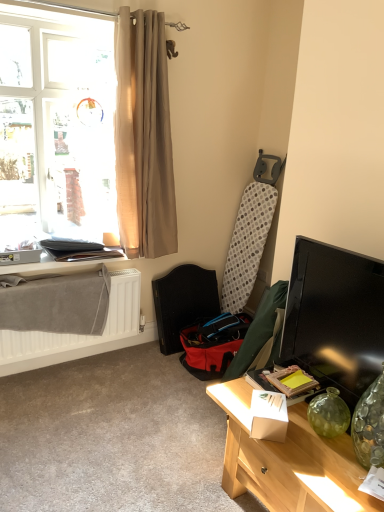
Question: Does matte black table at lower left have a smaller size compared to beige fabric curtain at upper left?

Choices:
 (A) no
 (B) yes

Answer: (B)

Question: Is matte black table at lower left wider than beige fabric curtain at upper left?

Choices:
 (A) yes
 (B) no

Answer: (A)

Question: Can you confirm if matte black table at lower left is shorter than beige fabric curtain at upper left?

Choices:
 (A) yes
 (B) no

Answer: (A)

Question: Is beige fabric curtain at upper left at the back of matte black table at lower left?

Choices:
 (A) no
 (B) yes

Answer: (A)

Question: Can you confirm if matte black table at lower left is bigger than beige fabric curtain at upper left?

Choices:
 (A) yes
 (B) no

Answer: (B)

Question: From a real-world perspective, relative to white matte radiator at lower left, is light wood desk at lower right vertically above or below?

Choices:
 (A) below
 (B) above

Answer: (A)

Question: From the image's perspective, is light wood desk at lower right above or below white matte radiator at lower left?

Choices:
 (A) below
 (B) above

Answer: (A)

Question: Would you say light wood desk at lower right is to the left or to the right of white matte radiator at lower left in the picture?

Choices:
 (A) right
 (B) left

Answer: (A)

Question: In the image, is light wood desk at lower right positioned in front of or behind white matte radiator at lower left?

Choices:
 (A) front
 (B) behind

Answer: (A)

Question: From the image's perspective, is red fabric folding chair at center located above or below translucent fabric window at upper left?

Choices:
 (A) below
 (B) above

Answer: (A)

Question: Is red fabric folding chair at center in front of or behind translucent fabric window at upper left in the image?

Choices:
 (A) behind
 (B) front

Answer: (A)

Question: Is point (200, 286) positioned closer to the camera than point (99, 55)?

Choices:
 (A) closer
 (B) farther

Answer: (B)

Question: From a real-world perspective, relative to translucent fabric window at upper left, is red fabric folding chair at center vertically above or below?

Choices:
 (A) below
 (B) above

Answer: (A)

Question: Relative to light wood desk at lower right, is beige fabric curtain at upper left in front or behind?

Choices:
 (A) front
 (B) behind

Answer: (B)

Question: Is point (129, 67) positioned closer to the camera than point (241, 444)?

Choices:
 (A) farther
 (B) closer

Answer: (A)